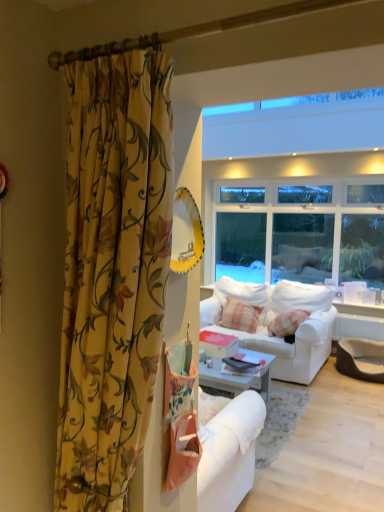
Question: In terms of width, does striped cotton pillow at center look wider or thinner when compared to floral fabric curtain at left?

Choices:
 (A) thin
 (B) wide

Answer: (A)

Question: From the image's perspective, is striped cotton pillow at center positioned above or below floral fabric curtain at left?

Choices:
 (A) above
 (B) below

Answer: (B)

Question: Estimate the real-world distances between objects in this image. Which object is farther from the floral fabric curtain at left?

Choices:
 (A) striped cotton pillow at center
 (B) white fabric couch at center

Answer: (A)

Question: Estimate the real-world distances between objects in this image. Which object is closer to the floral fabric curtain at left?

Choices:
 (A) white fabric couch at center
 (B) striped cotton pillow at center

Answer: (A)